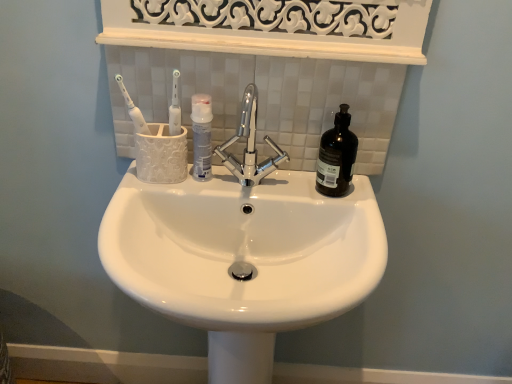
Question: From a real-world perspective, is white glossy toothbrush at upper left positioned under white matte mouthwash at center, which is the first mouthwash in left-to-right order, based on gravity?

Choices:
 (A) no
 (B) yes

Answer: (A)

Question: Does white glossy toothbrush at upper left have a lesser height compared to white matte mouthwash at center, acting as the 2th mouthwash starting from the right?

Choices:
 (A) yes
 (B) no

Answer: (B)

Question: From the image's perspective, would you say white glossy toothbrush at upper left is shown under white matte mouthwash at center, acting as the 2th mouthwash starting from the right?

Choices:
 (A) no
 (B) yes

Answer: (A)

Question: From the image's perspective, is white glossy toothbrush at upper left located above white matte mouthwash at center, which is the first mouthwash in left-to-right order?

Choices:
 (A) no
 (B) yes

Answer: (B)

Question: Is white glossy toothbrush at upper left thinner than white matte mouthwash at center, which is the first mouthwash in left-to-right order?

Choices:
 (A) no
 (B) yes

Answer: (B)

Question: From their relative heights in the image, would you say white matte mouthwash at center, acting as the 2th mouthwash starting from the right, is taller or shorter than black glass bottle at right, which ranks as the first mouthwash in right-to-left order?

Choices:
 (A) short
 (B) tall

Answer: (A)

Question: From a real-world perspective, relative to black glass bottle at right, which ranks as the first mouthwash in right-to-left order, is white matte mouthwash at center, acting as the 2th mouthwash starting from the right, vertically above or below?

Choices:
 (A) above
 (B) below

Answer: (B)

Question: Is white matte mouthwash at center, acting as the 2th mouthwash starting from the right, in front of or behind black glass bottle at right, which ranks as the first mouthwash in right-to-left order, in the image?

Choices:
 (A) behind
 (B) front

Answer: (A)

Question: Is white matte mouthwash at center, acting as the 2th mouthwash starting from the right, bigger or smaller than black glass bottle at right, which ranks as the first mouthwash in right-to-left order?

Choices:
 (A) small
 (B) big

Answer: (A)

Question: Relative to chrome metallic faucet at center, is white glossy toothbrush at upper left in front or behind?

Choices:
 (A) front
 (B) behind

Answer: (B)

Question: Does point (123, 92) appear closer or farther from the camera than point (243, 122)?

Choices:
 (A) farther
 (B) closer

Answer: (B)

Question: Is white glossy toothbrush at upper left spatially inside chrome metallic faucet at center, or outside of it?

Choices:
 (A) outside
 (B) inside

Answer: (A)

Question: From a real-world perspective, is white glossy toothbrush at upper left above or below chrome metallic faucet at center?

Choices:
 (A) above
 (B) below

Answer: (A)

Question: In the image, is black glass bottle at right, which ranks as the first mouthwash in right-to-left order, positioned in front of or behind white glossy toothbrush at upper left?

Choices:
 (A) behind
 (B) front

Answer: (A)

Question: In the image, is black glass bottle at right, which ranks as the first mouthwash in right-to-left order, on the left side or the right side of white glossy toothbrush at upper left?

Choices:
 (A) left
 (B) right

Answer: (B)